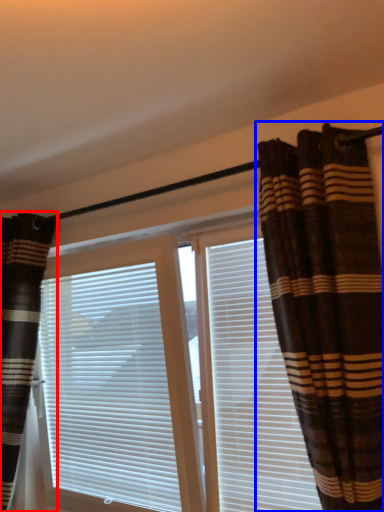
Question: Which of the following is the farthest to the observer, curtain (highlighted by a red box) or curtain (highlighted by a blue box)?

Choices:
 (A) curtain
 (B) curtain

Answer: (A)